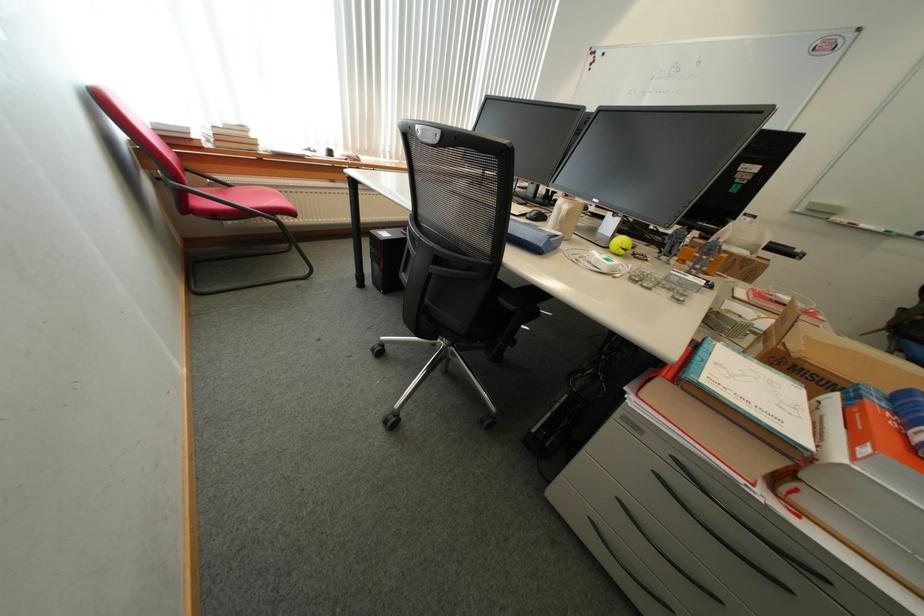
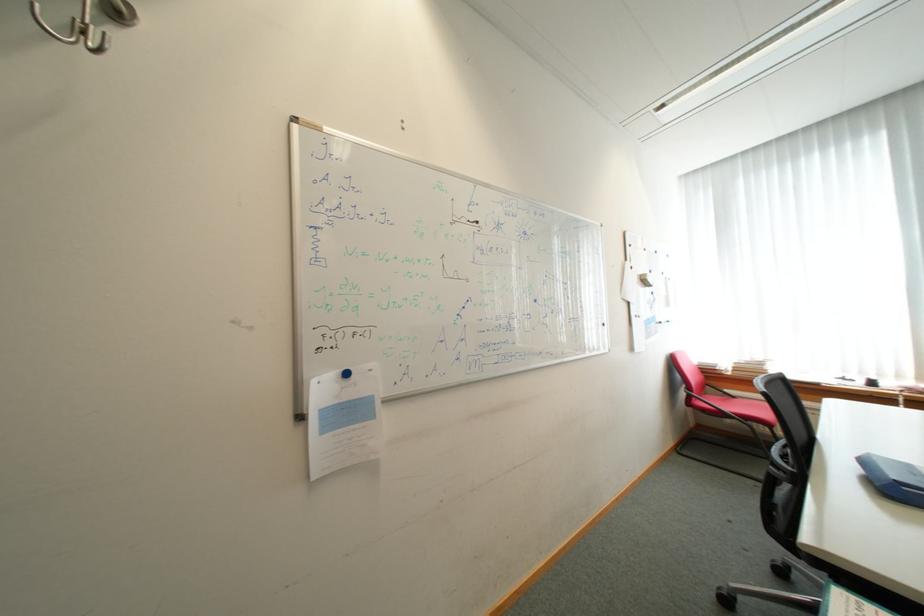
Locate, in the second image, the point that corresponds to (237,187) in the first image.

(743, 398)